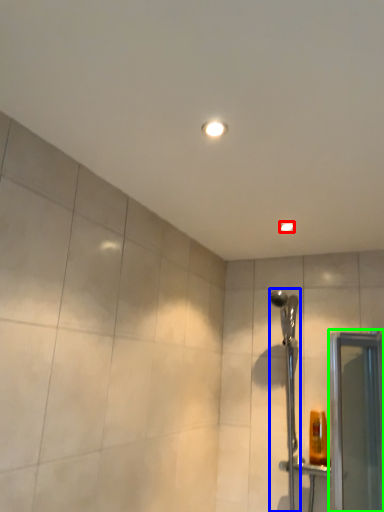
Question: Which is farther away from light fixture (highlighted by a red box)? shower (highlighted by a blue box) or screen door (highlighted by a green box)?

Choices:
 (A) shower
 (B) screen door

Answer: (B)